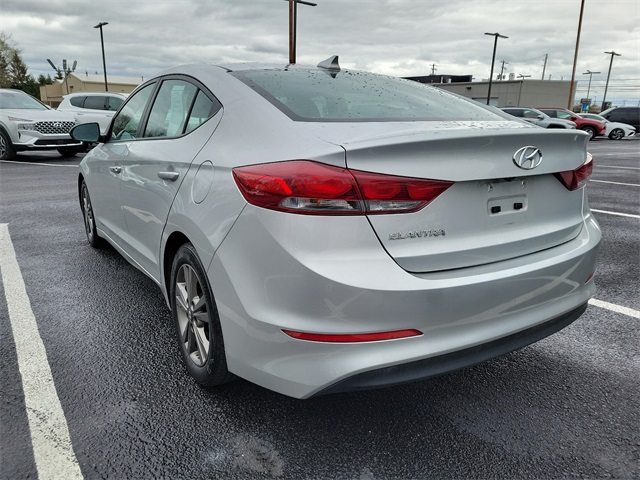
Find the location of a particular element. This screenshot has width=640, height=480. the left windows is located at coordinates (130, 119), (171, 108).